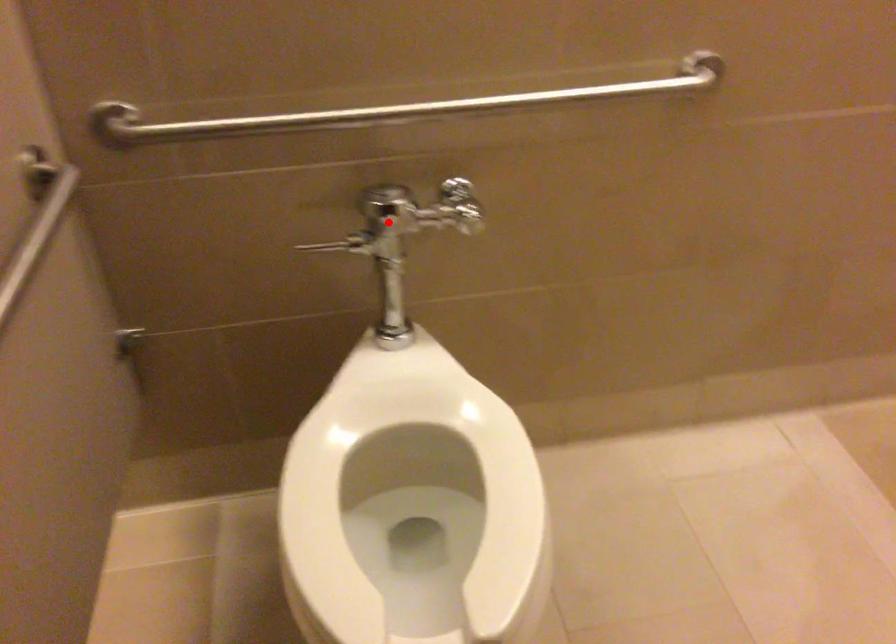
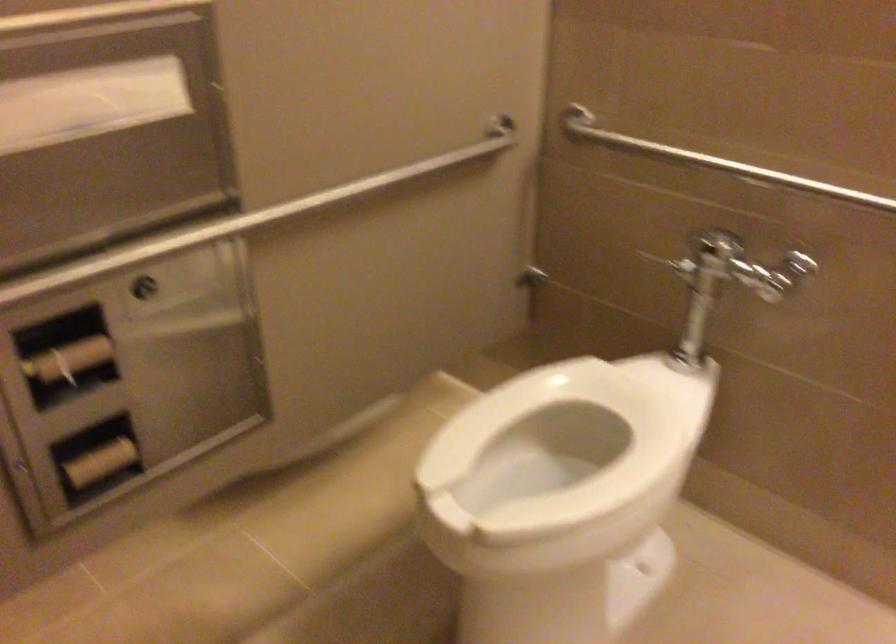
Question: I am providing you with two images of the same scene from different viewpoints. Image1 has a red point marked. In image2, the corresponding 3D location appears at what relative position? Reply with the corresponding letter.

Choices:
 (A) Closer
 (B) Farther

Answer: (B)